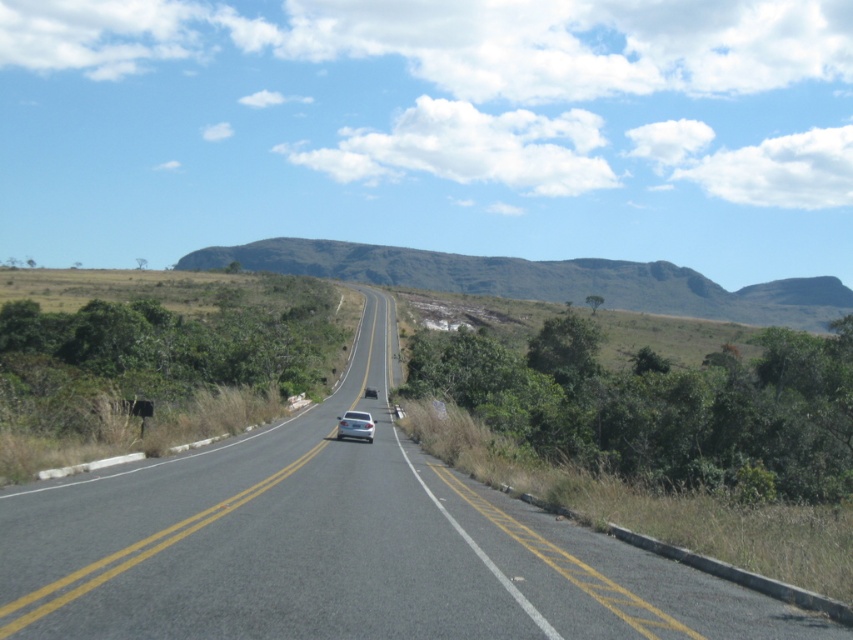
Question: Observing the image, what is the correct spatial positioning of asphalt road at center in reference to silver metallic car at center?

Choices:
 (A) right
 (B) left

Answer: (B)

Question: Is the position of rugged brown mountain at center more distant than that of silver metallic car at center?

Choices:
 (A) no
 (B) yes

Answer: (B)

Question: Can you confirm if asphalt road at center is thinner than rugged brown mountain at center?

Choices:
 (A) no
 (B) yes

Answer: (B)

Question: Among these points, which one is nearest to the camera?

Choices:
 (A) (67, 596)
 (B) (846, 291)

Answer: (A)

Question: Among these points, which one is farthest from the camera?

Choices:
 (A) (370, 442)
 (B) (699, 282)

Answer: (B)

Question: Which object appears farthest from the camera in this image?

Choices:
 (A) rugged brown mountain at center
 (B) asphalt road at center
 (C) silver metallic car at center

Answer: (A)